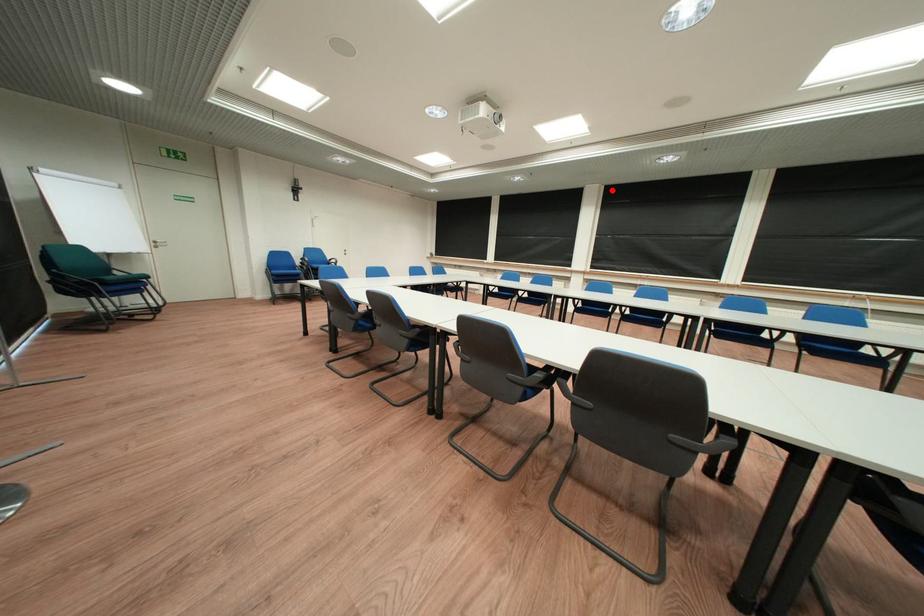
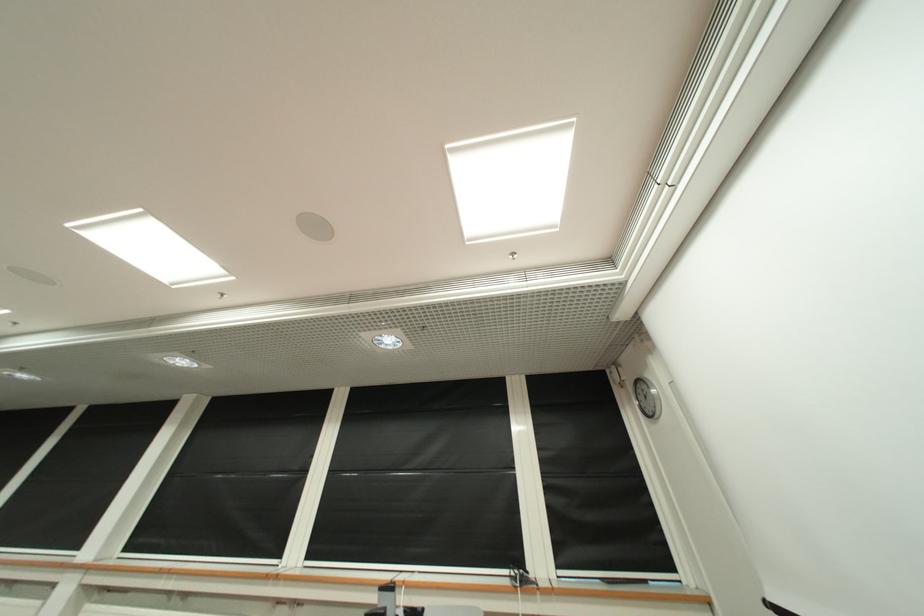
Where in the second image is the point corresponding to the highlighted location from the first image?

(210, 402)